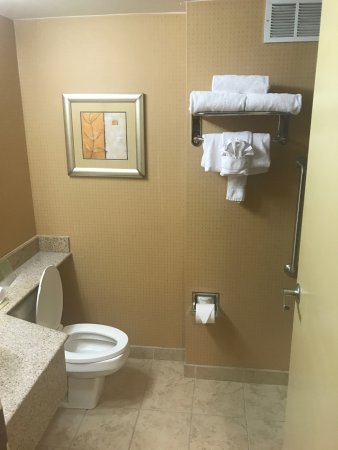
Image resolution: width=338 pixels, height=450 pixels. In order to click on vent in this screenshot , I will do `click(285, 20)`, `click(309, 17)`.